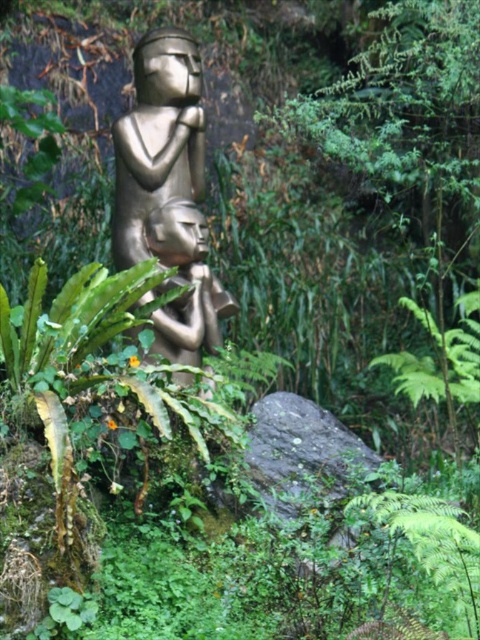
Who is positioned more to the right, gold polished statue at center or gold metallic figurine at center?

gold metallic figurine at center

Between point (218, 298) and point (179, 202), which one is positioned behind?

The point (218, 298) is more distant.

Is point (215, 314) positioned in front of point (175, 310)?

No, (215, 314) is further to viewer.

Locate an element on the screen. The height and width of the screenshot is (640, 480). gold polished statue at center is located at coordinates (168, 193).